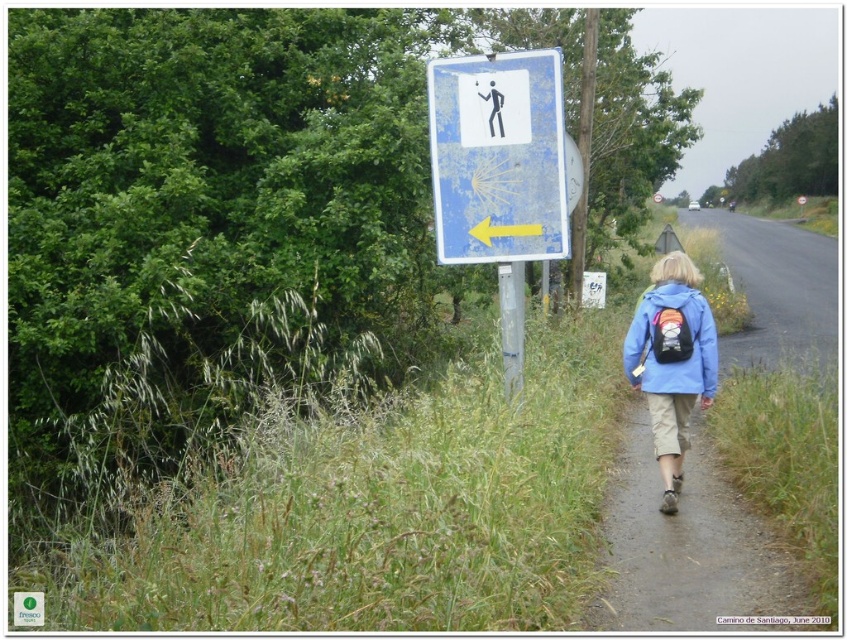
Is point (754, 532) closer to camera compared to point (515, 70)?

Yes, it is.

Does dirt path at lower right lie behind blue faded sign at upper center?

That is False.

Who is more distant from viewer, [728,365] or [543,212]?

The point [728,365] is more distant.

This screenshot has width=847, height=640. In order to click on dirt path at lower right in this screenshot , I will do [x=685, y=545].

Who is more forward, (811,317) or (479,234)?

Point (479,234)

The height and width of the screenshot is (640, 847). What do you see at coordinates (685, 545) in the screenshot? I see `dirt path at lower right` at bounding box center [685, 545].

Is point (818, 356) farther from viewer compared to point (497, 234)?

Yes, point (818, 356) is behind point (497, 234).

Locate an element on the screen. This screenshot has height=640, width=847. dirt path at lower right is located at coordinates (685, 545).

Does blue fabric backpack at center-right appear on the left side of blue matte jacket at lower right?

Incorrect, blue fabric backpack at center-right is not on the left side of blue matte jacket at lower right.

Is blue fabric backpack at center-right below blue matte jacket at lower right?

Yes, blue fabric backpack at center-right is below blue matte jacket at lower right.

Image resolution: width=847 pixels, height=640 pixels. What do you see at coordinates (671, 362) in the screenshot?
I see `blue fabric backpack at center-right` at bounding box center [671, 362].

Where is `blue fabric backpack at center-right`? Image resolution: width=847 pixels, height=640 pixels. blue fabric backpack at center-right is located at coordinates (671, 362).